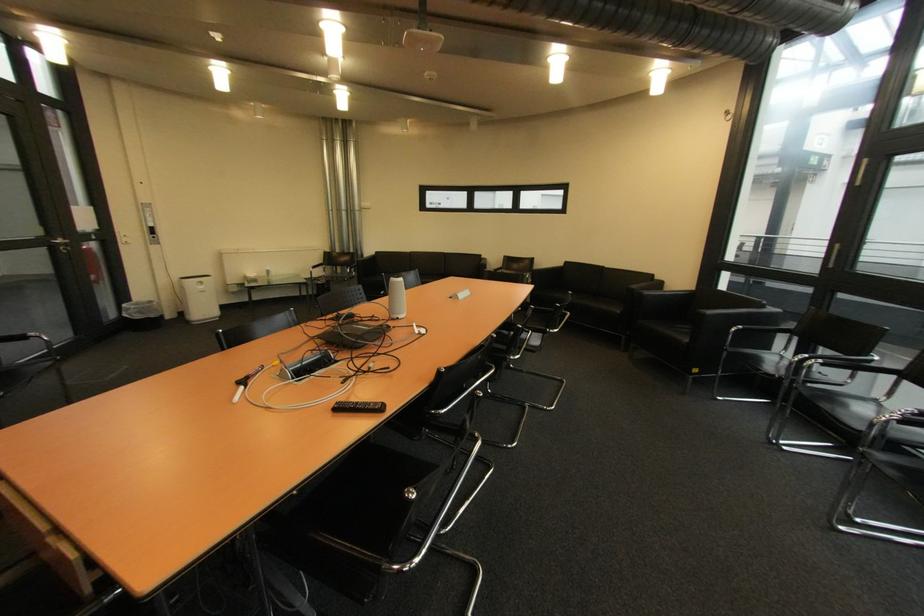
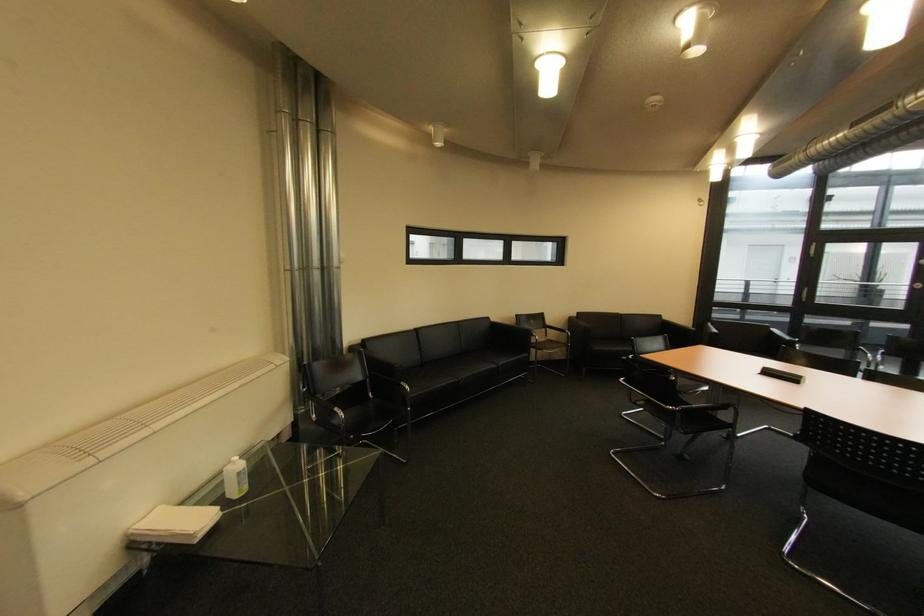
Question: I am providing you with two images of the same scene from different viewpoints. Which of the following objects are not visible in image2?

Choices:
 (A) sofa sitting surface
 (B) sofa armrest
 (C) chair sitting surface
 (D) small green pot

Answer: (C)